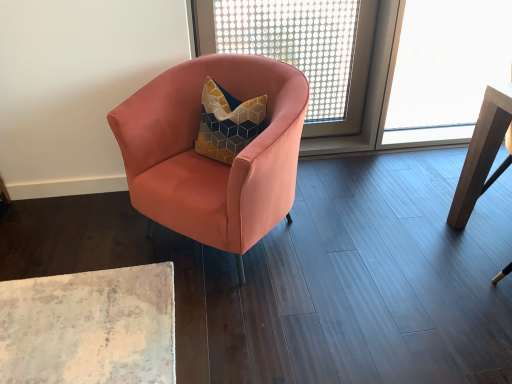
You are a GUI agent. You are given a task and a screenshot of the screen. Output one action in this format:
    pyautogui.click(x=<x>, y=<y>)
    Task: Click on the vacant area located to the right-hand side of matte pink armchair at center
    This screenshot has height=384, width=512.
    Given the screenshot: What is the action you would take?
    357,235